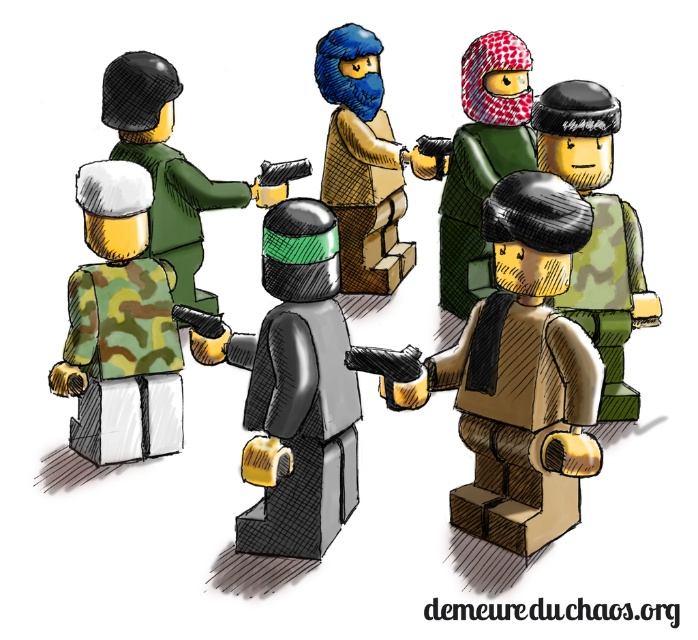
Question: Which object is farther from the camera taking this photo?

Choices:
 (A) matte green helmet at center
 (B) patterned fabric mask at center

Answer: (B)

Question: Can you confirm if brown matte vest at center is positioned below camouflage fabric helmet at center?

Choices:
 (A) no
 (B) yes

Answer: (B)

Question: Can you confirm if camouflage fabric figure at left is positioned to the left of camouflage fabric helmet at center?

Choices:
 (A) yes
 (B) no

Answer: (A)

Question: Estimate the real-world distances between objects in this image. Which object is closer to the matte green helmet at center?

Choices:
 (A) matte black helmet at center
 (B) brown matte/wooden block at center

Answer: (B)

Question: Does matte black helmet at center have a lesser width compared to camouflage fabric figure at left?

Choices:
 (A) no
 (B) yes

Answer: (A)

Question: Which point appears farthest from the camera in this image?

Choices:
 (A) (454, 516)
 (B) (289, 198)
 (C) (482, 118)
 (D) (110, 182)

Answer: (C)